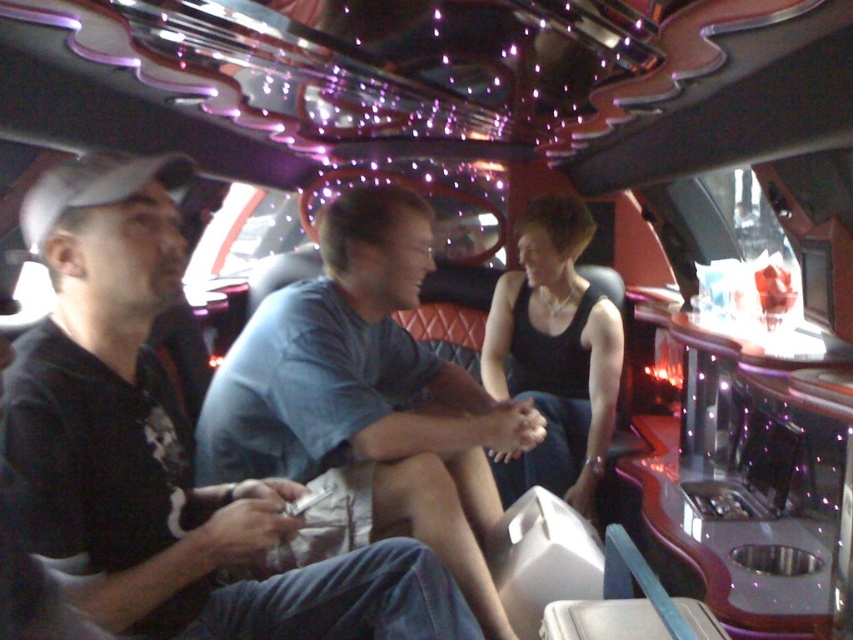
Who is more forward, (480, 397) or (496, 380)?

Point (480, 397)

What do you see at coordinates (364, 403) in the screenshot?
I see `blue cotton shirt at center` at bounding box center [364, 403].

At what (x,y) coordinates should I click in order to perform the action: click on blue cotton shirt at center. Please return your answer as a coordinate pair (x, y). The height and width of the screenshot is (640, 853). Looking at the image, I should click on (364, 403).